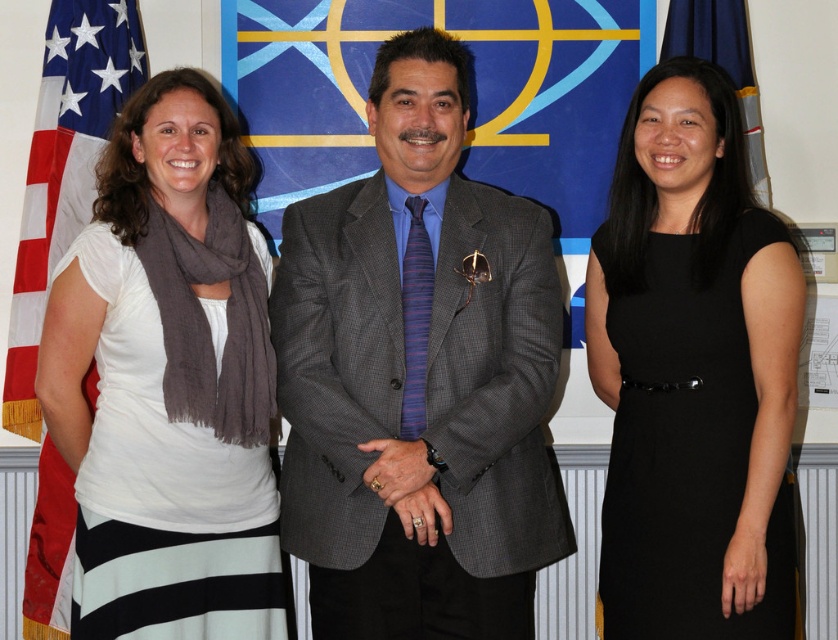
Can you confirm if gray textured suit at center is positioned below blue fabric flag at upper right?

Correct, gray textured suit at center is located below blue fabric flag at upper right.

Does gray textured suit at center appear over blue fabric flag at upper right?

Incorrect, gray textured suit at center is not positioned above blue fabric flag at upper right.

At what (x,y) coordinates should I click in order to perform the action: click on gray textured suit at center. Please return your answer as a coordinate pair (x, y). Looking at the image, I should click on (419, 378).

I want to click on gray textured suit at center, so point(419,378).

Which is behind, point (546, 554) or point (769, 294)?

The point (546, 554) is behind.

Does point (489, 509) come farther from viewer compared to point (712, 285)?

Yes, point (489, 509) is farther from viewer.

Is point (469, 337) in front of point (797, 316)?

That is False.

This screenshot has height=640, width=838. Identify the location of gray textured suit at center. (419, 378).

Is point (236, 161) behind point (735, 20)?

No, it is in front of (735, 20).

Between white cotton scarf at left and blue fabric flag at upper right, which one appears on the right side from the viewer's perspective?

blue fabric flag at upper right is more to the right.

Where is `white cotton scarf at left`? white cotton scarf at left is located at coordinates (168, 381).